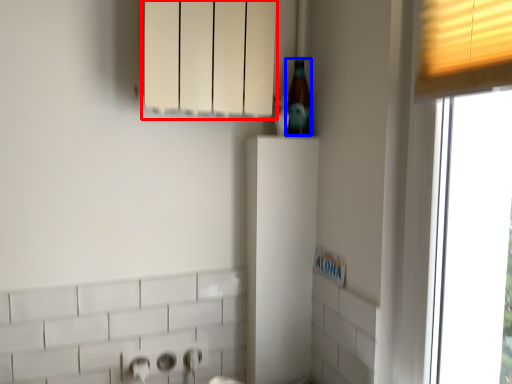
Question: Which of the following is the closest to the observer, cabinetry (highlighted by a red box) or beer bottle (highlighted by a blue box)?

Choices:
 (A) cabinetry
 (B) beer bottle

Answer: (A)